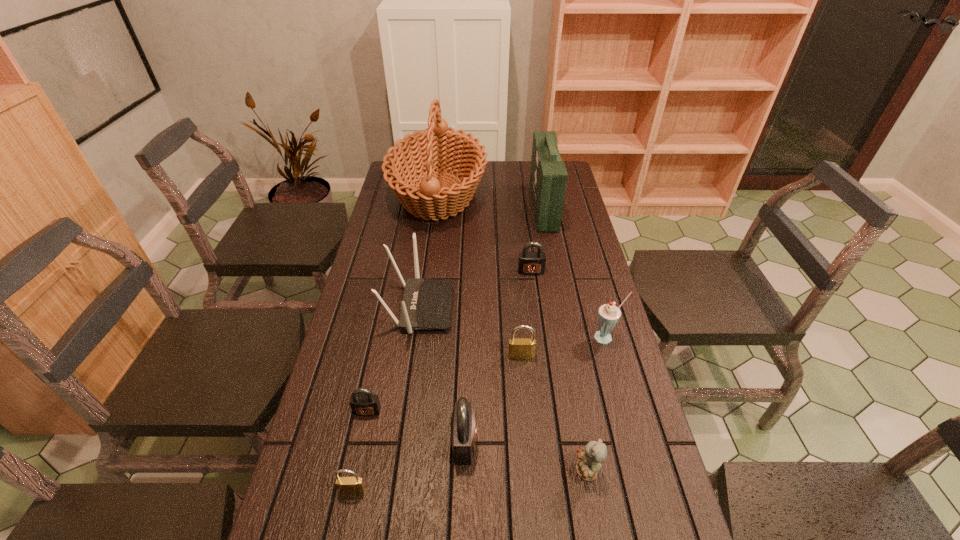
The image size is (960, 540). In order to click on empty space between the blue teddy bear and the third padlock from left to right in this screenshot , I will do `click(525, 457)`.

Select which object appears as the ninth closest to the second nearest padlock. Please provide its 2D coordinates. Your answer should be formatted as a tuple, i.e. [(x, y)], where the tuple contains the x and y coordinates of a point satisfying the conditions above.

[(548, 176)]

Locate an element on the screen. The image size is (960, 540). object that is the second closest to the basket is located at coordinates (529, 263).

Locate which padlock ranks fourth in proximity to the fifth nearest object. Please provide its 2D coordinates. Your answer should be formatted as a tuple, i.e. [(x, y)], where the tuple contains the x and y coordinates of a point satisfying the conditions above.

[(346, 485)]

You are a GUI agent. You are given a task and a screenshot of the screen. Output one action in this format:
    pyautogui.click(x=<x>, y=<y>)
    Task: Click on the padlock that stands as the third closest to the teddy bear
    
    Given the screenshot: What is the action you would take?
    pyautogui.click(x=346, y=485)

Choose which gray padlock is the second nearest neighbor to the tallest padlock. Please provide its 2D coordinates. Your answer should be formatted as a tuple, i.e. [(x, y)], where the tuple contains the x and y coordinates of a point satisfying the conditions above.

[(529, 263)]

Point out which gray padlock is positioned as the third nearest to the left brass padlock. Please provide its 2D coordinates. Your answer should be formatted as a tuple, i.e. [(x, y)], where the tuple contains the x and y coordinates of a point satisfying the conditions above.

[(529, 263)]

Locate an element on the screen. Image resolution: width=960 pixels, height=540 pixels. vacant area that satisfies the following two spatial constraints: 1. on the front of the second gray padlock from left to right near the keyhole; 2. on the front-facing side of the nearer brass padlock is located at coordinates (463, 490).

Identify the location of vacant space that satisfies the following two spatial constraints: 1. on the front side of the basket; 2. on the front-facing side of the router. (423, 308).